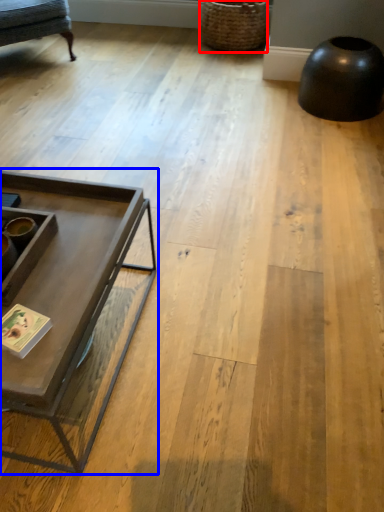
Question: Which point is closer to the camera, basket (highlighted by a red box) or coffee table (highlighted by a blue box)?

Choices:
 (A) basket
 (B) coffee table

Answer: (B)